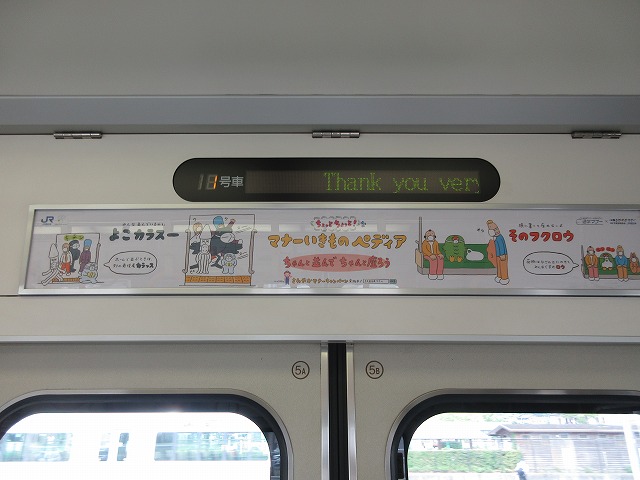
You are a GUI agent. You are given a task and a screenshot of the screen. Output one action in this format:
    pyautogui.click(x=<x>, y=<y>)
    Task: Click on the right door
    The image size is (640, 480).
    Given the screenshot: What is the action you would take?
    pyautogui.click(x=413, y=366)